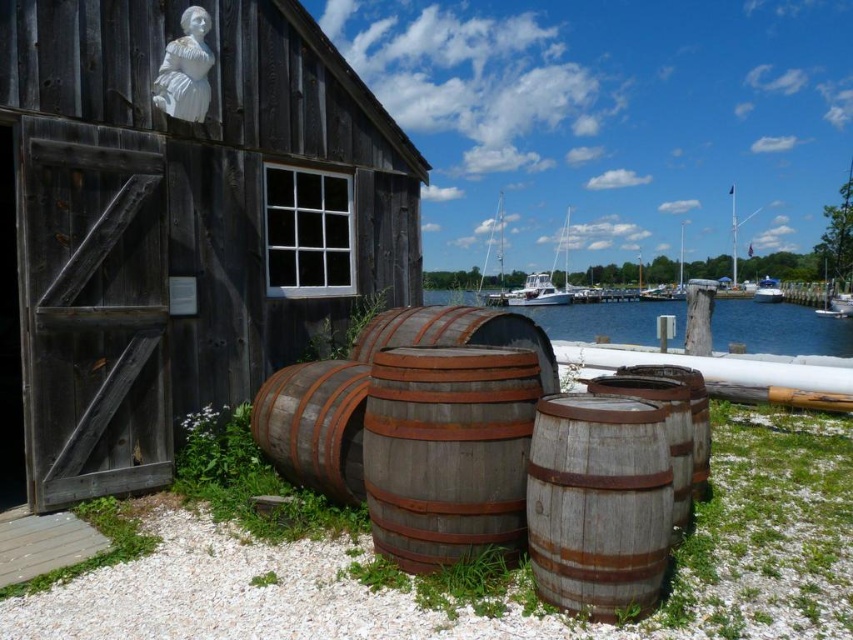
Question: Which of the following is the closest to the observer?

Choices:
 (A) blue water at center
 (B) dark brown wooden barn at left
 (C) wooden barrel at center

Answer: (C)

Question: Which object appears farthest from the camera in this image?

Choices:
 (A) wooden barrel at center
 (B) wooden dock at lower left
 (C) weathered wood barrel at center
 (D) rusty wood barrels at center

Answer: (B)

Question: Does dark brown wooden barn at left appear on the left side of weathered wood barrel at center?

Choices:
 (A) no
 (B) yes

Answer: (B)

Question: Can you confirm if weathered wood barrel at center is wider than blue water at center?

Choices:
 (A) no
 (B) yes

Answer: (A)

Question: Can you confirm if dark brown wooden barn at left is wider than wooden barrel at center?

Choices:
 (A) no
 (B) yes

Answer: (B)

Question: Which point is closer to the camera?

Choices:
 (A) (801, 340)
 (B) (103, 468)
 (C) (55, 566)

Answer: (C)